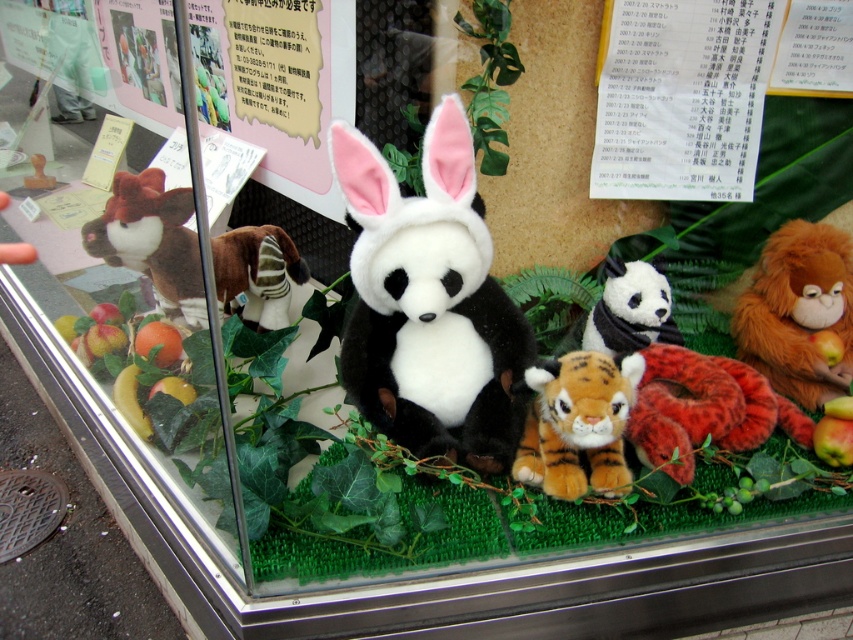
Question: Which of the following is the farthest from the observer?

Choices:
 (A) orange plush tiger at center
 (B) matte black plush panda at center
 (C) orange plush monkey at right

Answer: (C)

Question: Which of these objects is positioned farthest from the matte black plush panda at center?

Choices:
 (A) black plush panda at center
 (B) orange plush tiger at center
 (C) velvet orange tiger at center

Answer: (A)

Question: Does black plush panda at center have a greater width compared to velvet plush zebra at center?

Choices:
 (A) yes
 (B) no

Answer: (A)

Question: Where is velvet orange tiger at center located in relation to matte black plush panda at center in the image?

Choices:
 (A) above
 (B) below

Answer: (B)

Question: Which of the following is the farthest from the observer?

Choices:
 (A) (640, 328)
 (B) (560, 433)
 (C) (492, 445)

Answer: (A)

Question: Can you confirm if orange plush tiger at center is bigger than velvet plush zebra at center?

Choices:
 (A) no
 (B) yes

Answer: (A)